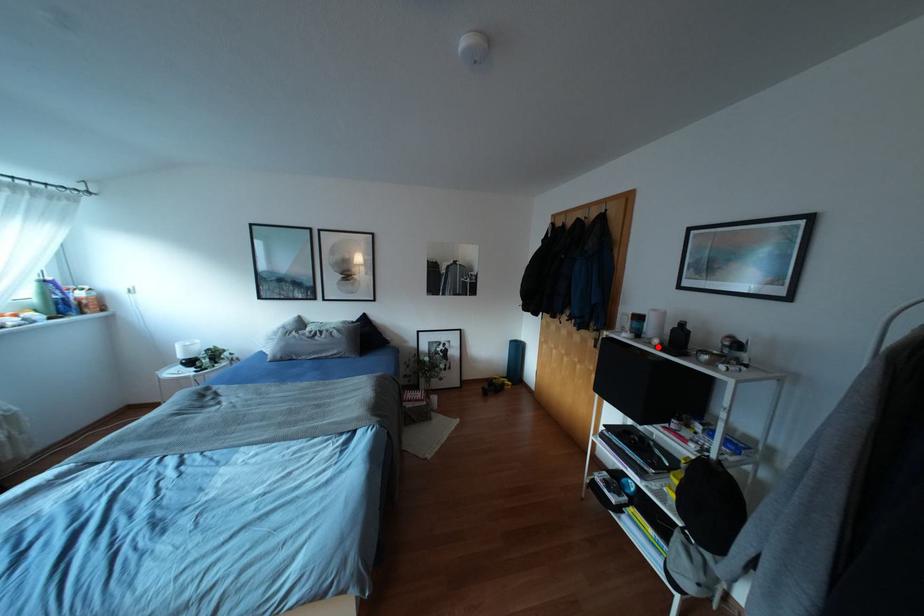
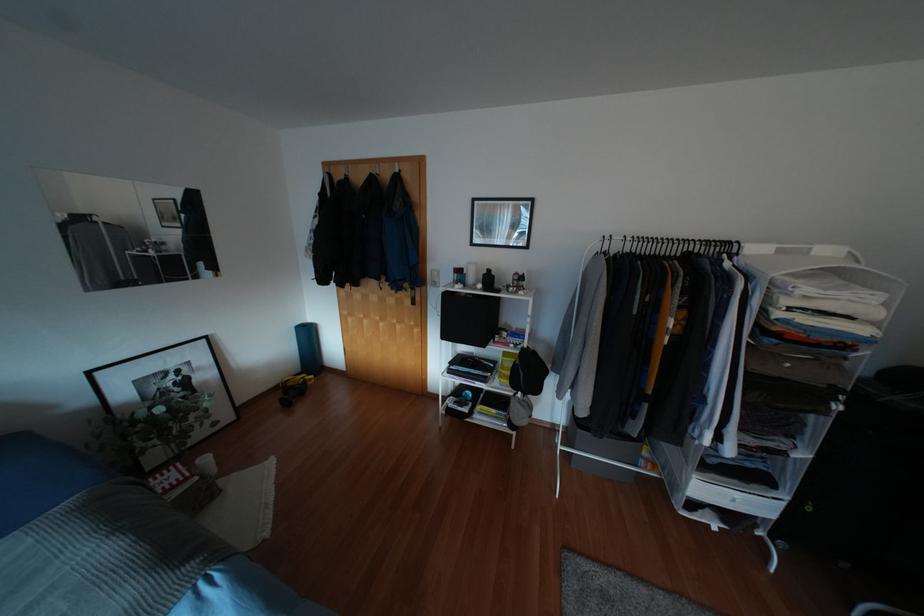
Find the pixel in the second image that matches the highlighted location in the first image.

(483, 289)